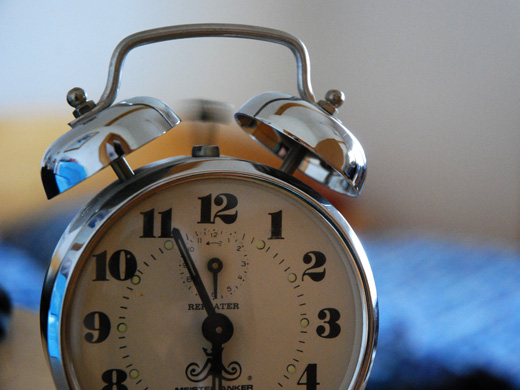
Identify the location of black minute hand on clock. (198, 282).